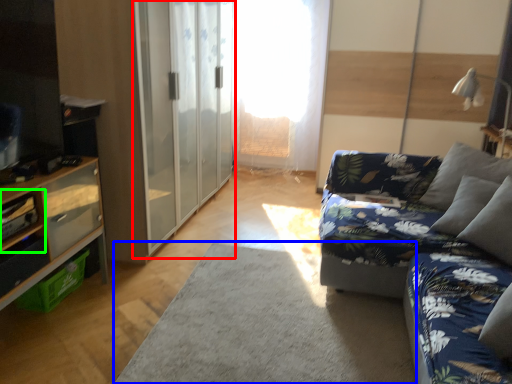
Question: Which object is the closest to the barn door (highlighted by a red box)? Choose among these: plain (highlighted by a blue box) or shelf (highlighted by a green box).

Choices:
 (A) plain
 (B) shelf

Answer: (A)